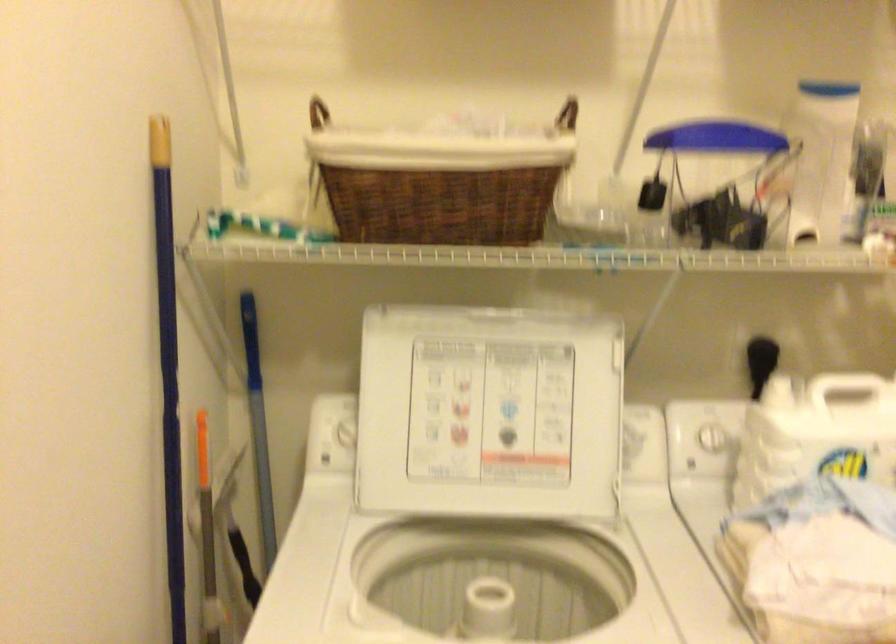
The image size is (896, 644). What are the coordinates of `black tool handle` in the screenshot? It's located at (760, 362).